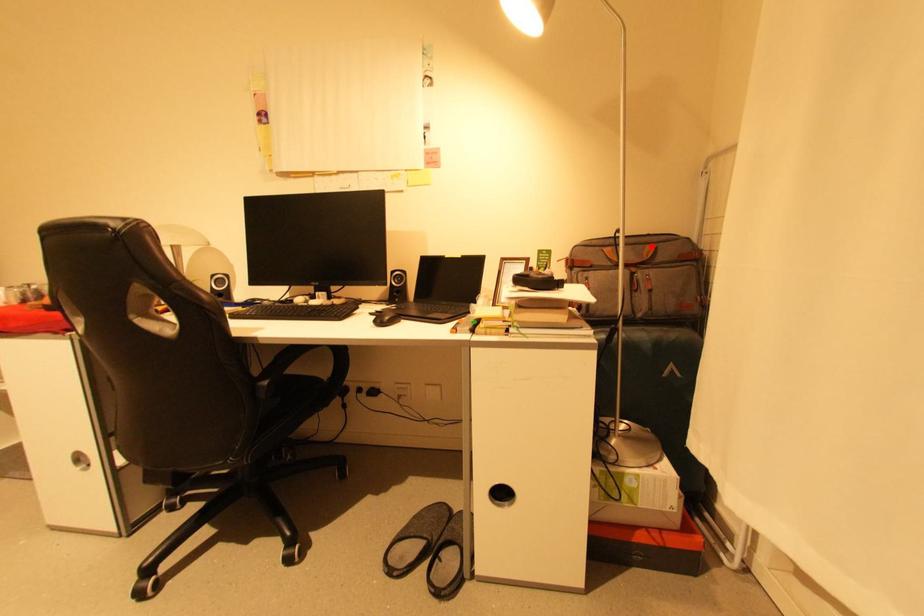
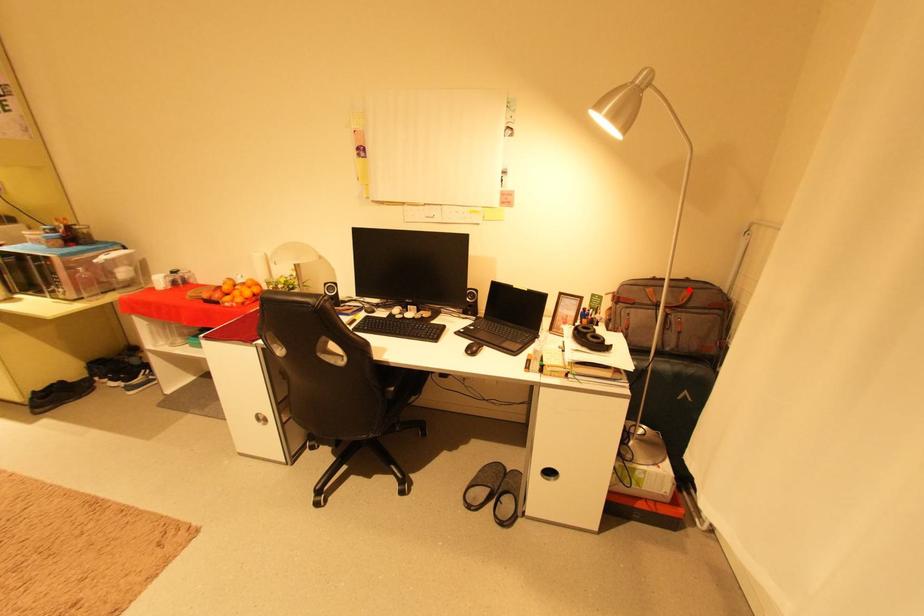
Looking at this image, I am providing you with two images of the same scene from different viewpoints. A red point is marked on the first image and another point is marked on the second image. Is the marked point in image1 the same physical position as the marked point in image2?

Yes